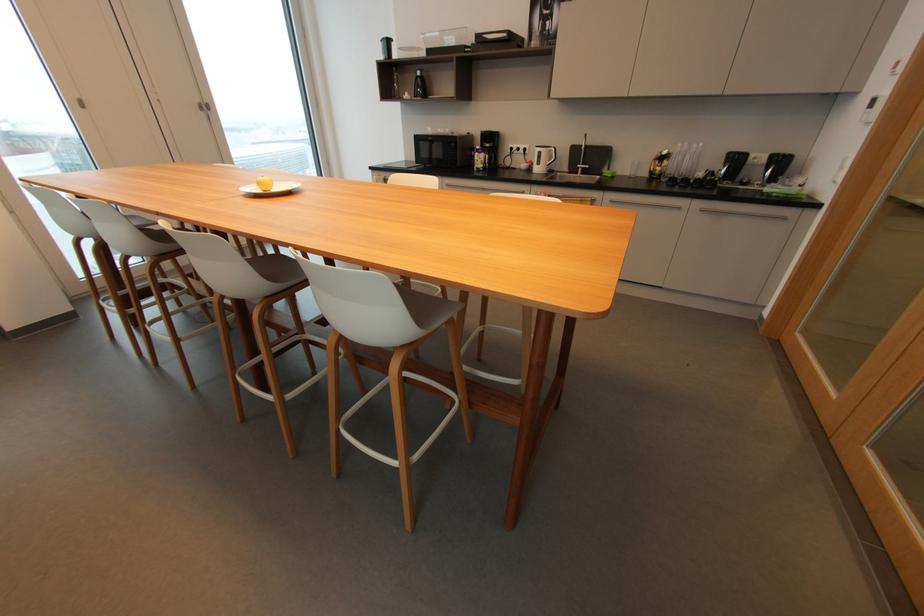
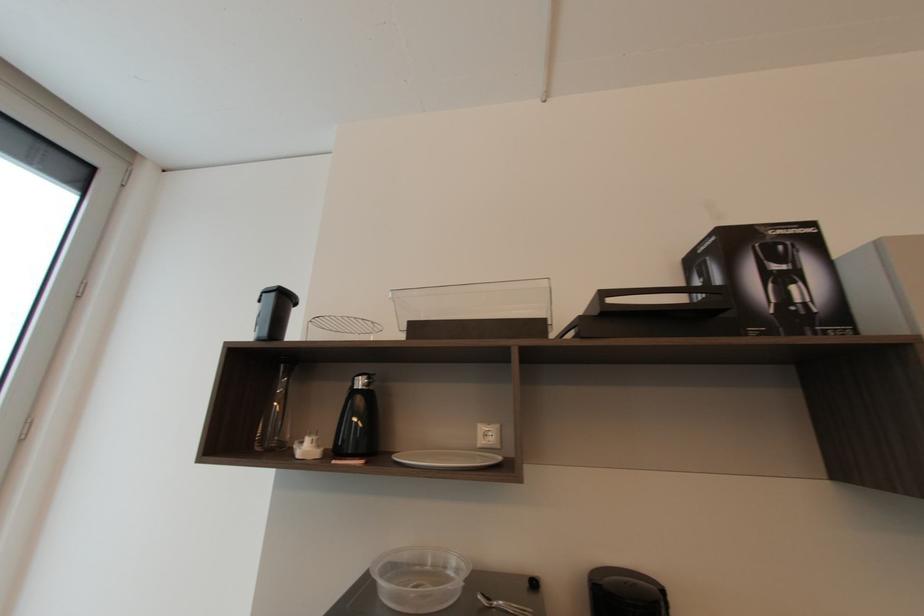
The point at (421, 74) is marked in the first image. Where is the corresponding point in the second image?

(362, 384)